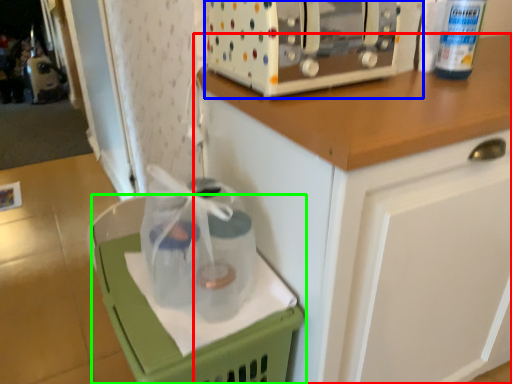
Question: Which object is the closest to the cabinetry (highlighted by a red box)? Choose among these: home appliance (highlighted by a blue box) or basket (highlighted by a green box).

Choices:
 (A) home appliance
 (B) basket

Answer: (A)